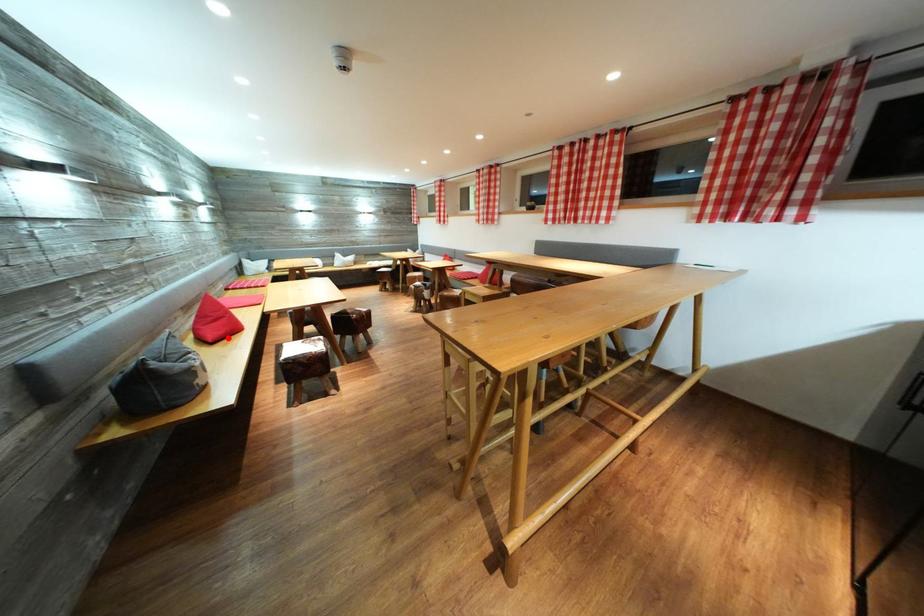
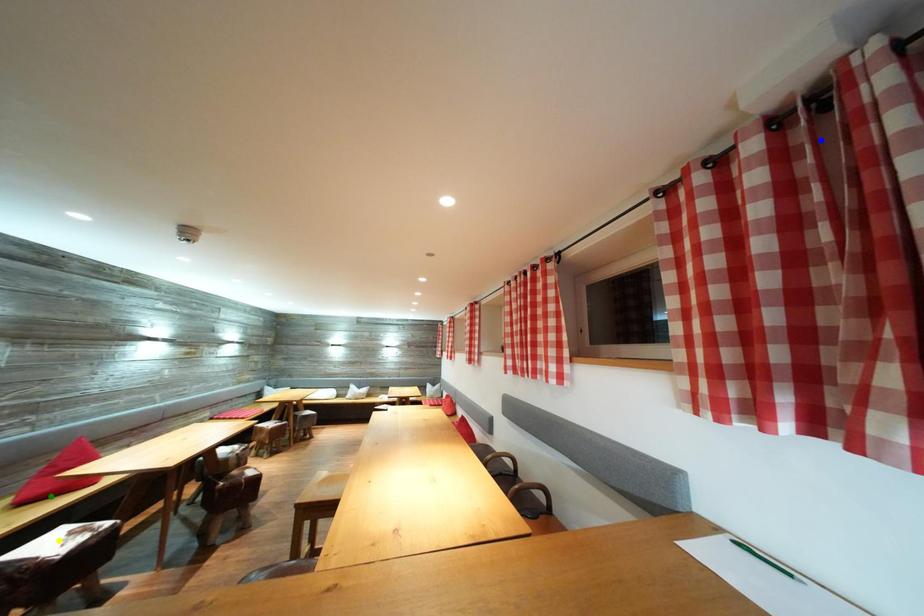
Question: I am providing you with two images of the same scene from different viewpoints. A red point is marked on the first image. You are given multiple points on the second image. In image 2, which mark is for the same physical point as the one in image 1?

Choices:
 (A) green point
 (B) blue point
 (C) yellow point

Answer: (A)